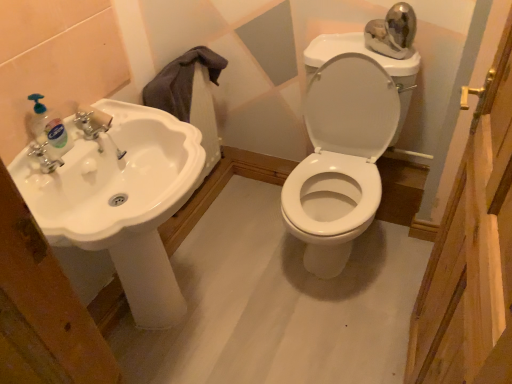
Question: Are translucent plastic soap dispenser at left and white glossy sink at left beside each other?

Choices:
 (A) no
 (B) yes

Answer: (A)

Question: From the image's perspective, is translucent plastic soap dispenser at left under white glossy sink at left?

Choices:
 (A) yes
 (B) no

Answer: (B)

Question: Is translucent plastic soap dispenser at left oriented away from white glossy sink at left?

Choices:
 (A) yes
 (B) no

Answer: (B)

Question: Considering the relative positions of translucent plastic soap dispenser at left and white glossy sink at left in the image provided, is translucent plastic soap dispenser at left to the right of white glossy sink at left from the viewer's perspective?

Choices:
 (A) yes
 (B) no

Answer: (B)

Question: Can you confirm if translucent plastic soap dispenser at left is thinner than white glossy sink at left?

Choices:
 (A) no
 (B) yes

Answer: (B)

Question: From the image's perspective, is white glossy toilet at center positioned above or below white glossy sink at left?

Choices:
 (A) above
 (B) below

Answer: (A)

Question: Is point (327, 162) closer or farther from the camera than point (81, 236)?

Choices:
 (A) closer
 (B) farther

Answer: (B)

Question: Is white glossy toilet at center inside the boundaries of white glossy sink at left, or outside?

Choices:
 (A) inside
 (B) outside

Answer: (B)

Question: In the image, is white glossy toilet at center positioned in front of or behind white glossy sink at left?

Choices:
 (A) front
 (B) behind

Answer: (B)

Question: Would you say white glossy sink at left is inside or outside translucent plastic soap dispenser at left?

Choices:
 (A) outside
 (B) inside

Answer: (A)

Question: Is white glossy sink at left wider or thinner than translucent plastic soap dispenser at left?

Choices:
 (A) thin
 (B) wide

Answer: (B)

Question: Is white glossy sink at left in front of or behind translucent plastic soap dispenser at left in the image?

Choices:
 (A) front
 (B) behind

Answer: (A)

Question: Looking at the image, does white glossy sink at left seem bigger or smaller compared to translucent plastic soap dispenser at left?

Choices:
 (A) small
 (B) big

Answer: (B)

Question: Which is correct: white glossy toilet at center is inside translucent plastic soap dispenser at left, or outside of it?

Choices:
 (A) outside
 (B) inside

Answer: (A)

Question: Considering their positions, is white glossy toilet at center located in front of or behind translucent plastic soap dispenser at left?

Choices:
 (A) behind
 (B) front

Answer: (A)